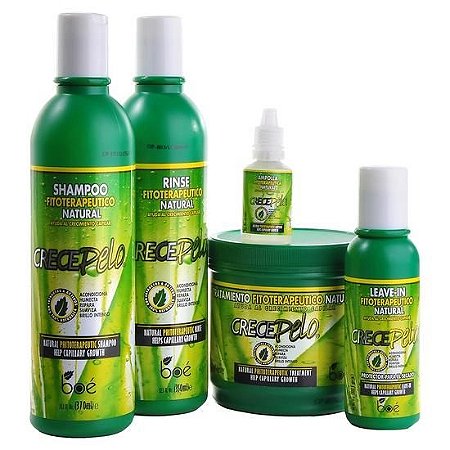
Where is `green plastic container`? The image size is (450, 450). green plastic container is located at coordinates point(105,428), point(181,407), point(249,400), point(380,426).